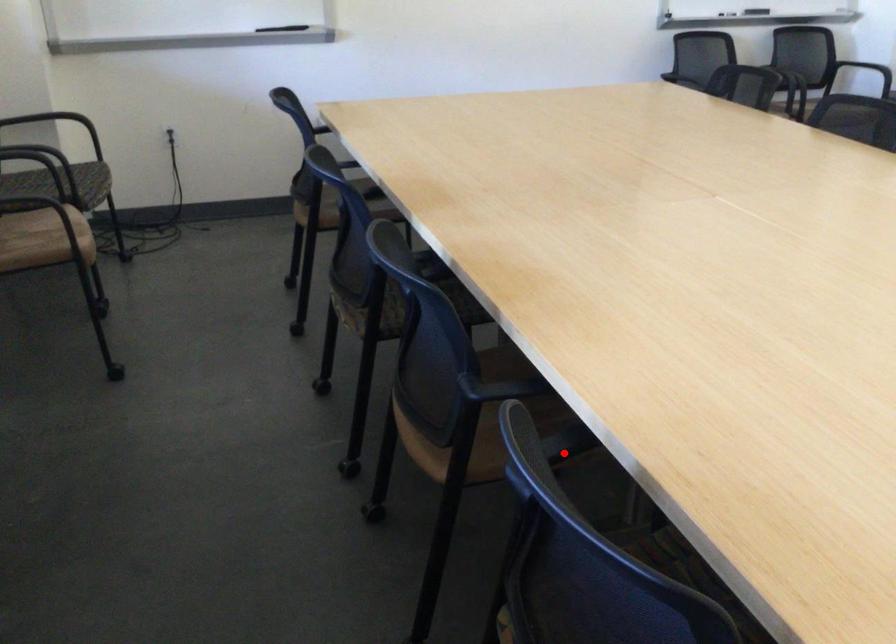
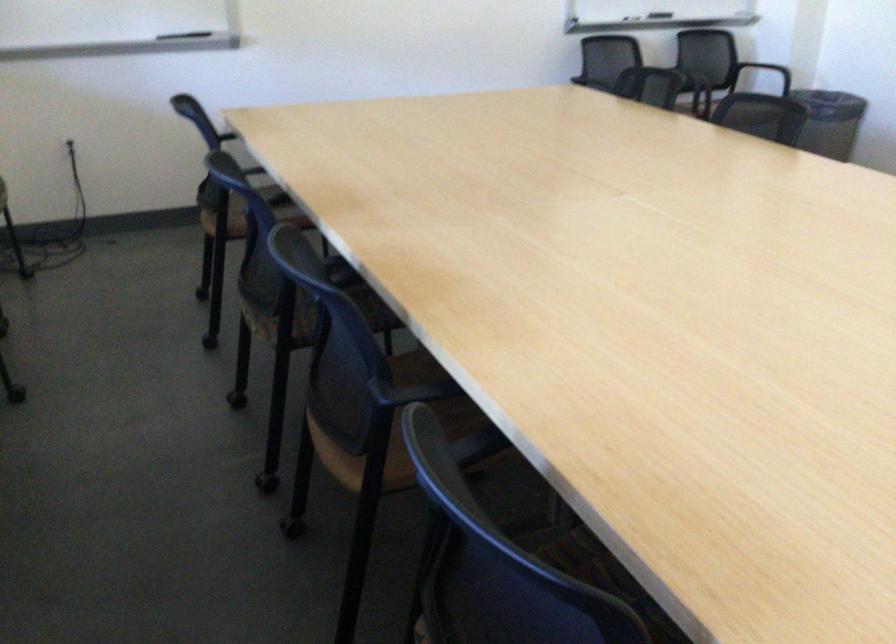
Where in the second image is the point corresponding to the highlighted location from the first image?

(475, 451)